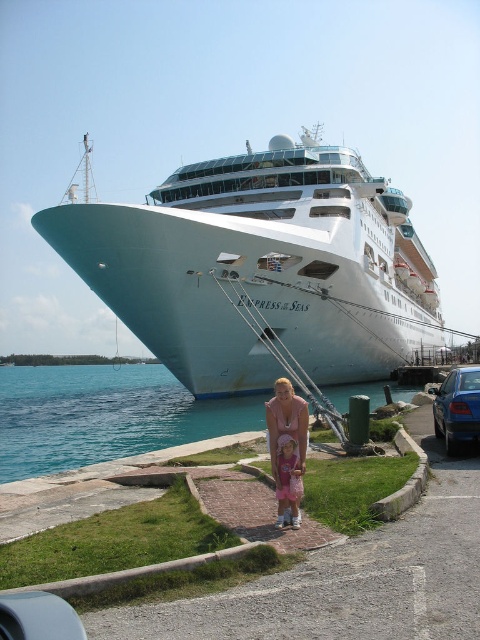
Consider the image. You are a photographer on the cruise ship and want to capture both the blue metallic car at lower right and the matte pink dress at center in the same frame. Based on their positions, which object is closer to the camera?

The blue metallic car at lower right is located below the matte pink dress at center, meaning it is closer to the camera since objects lower in the frame are typically nearer.

You are standing at point (288, 388) and want to walk to the cruise ship. Which direction should you go relative to point (210, 324)?

To reach the cruise ship from point (288, 388), you should move towards point (210, 324), which is behind your current position. Since point (210, 324) is behind point (288, 388), moving towards it would mean walking in the direction opposite to where you are facing. However, based on the scene description, the cruise ship is docked at the pier, so you might need to adjust your path towards the ship while considering the spatial relationship between the points.